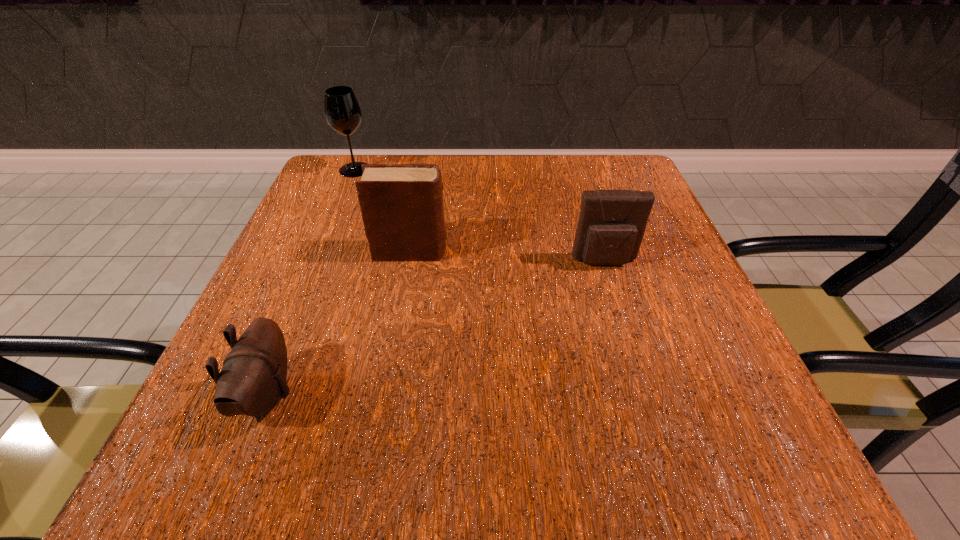
At what (x,y) coordinates should I click in order to perform the action: click on object at the far edge. Please return your answer as a coordinate pair (x, y). Looking at the image, I should click on (342, 111).

The image size is (960, 540). Identify the location of object situated at the near edge. (252, 380).

This screenshot has height=540, width=960. In order to click on wineglass present at the left edge in this screenshot , I will do `click(342, 111)`.

The width and height of the screenshot is (960, 540). In order to click on pouch located in the left edge section of the desktop in this screenshot , I will do `click(252, 380)`.

You are a GUI agent. You are given a task and a screenshot of the screen. Output one action in this format:
    pyautogui.click(x=<x>, y=<y>)
    Task: Click on the object that is at the right edge
    The image size is (960, 540).
    Given the screenshot: What is the action you would take?
    pyautogui.click(x=612, y=223)

Image resolution: width=960 pixels, height=540 pixels. I want to click on object located in the far left corner section of the desktop, so click(x=342, y=111).

Find the location of a particular element. The height and width of the screenshot is (540, 960). object that is at the near left corner is located at coordinates (252, 380).

At what (x,y) coordinates should I click in order to perform the action: click on vacant space at the far edge of the desktop. Please return your answer as a coordinate pair (x, y). This screenshot has height=540, width=960. Looking at the image, I should click on (476, 156).

Identify the location of free region at the near edge of the desktop. The width and height of the screenshot is (960, 540). (614, 450).

Image resolution: width=960 pixels, height=540 pixels. Find the location of `free space at the left edge`. free space at the left edge is located at coordinates (242, 318).